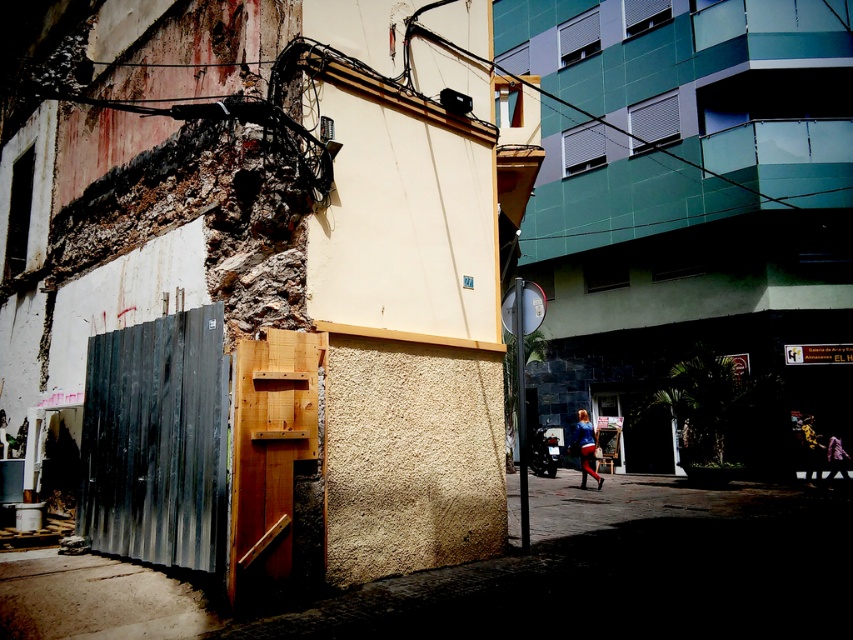
Measure the distance from metallic gold helmet at center to leather jacket at center.

13.75 inches

Is point (805, 464) closer to viewer compared to point (840, 451)?

No.

Is point (814, 452) positioned after point (834, 449)?

Yes, point (814, 452) is behind point (834, 449).

This screenshot has width=853, height=640. What are the coordinates of `metallic gold helmet at center` in the screenshot? It's located at (811, 451).

Is blue fabric skirt at lower center positioned before metallic gold helmet at center?

Yes, it is in front of metallic gold helmet at center.

Can you confirm if blue fabric skirt at lower center is positioned below metallic gold helmet at center?

Yes.

This screenshot has height=640, width=853. What are the coordinates of `blue fabric skirt at lower center` in the screenshot? It's located at (584, 445).

Find the location of a particular element. blue fabric skirt at lower center is located at coordinates click(x=584, y=445).

Is blue fabric skirt at lower center thinner than leather jacket at center?

Correct, blue fabric skirt at lower center's width is less than leather jacket at center's.

Is the position of blue fabric skirt at lower center more distant than that of leather jacket at center?

That is False.

This screenshot has width=853, height=640. What do you see at coordinates (584, 445) in the screenshot? I see `blue fabric skirt at lower center` at bounding box center [584, 445].

Where is `blue fabric skirt at lower center`? This screenshot has width=853, height=640. blue fabric skirt at lower center is located at coordinates [x=584, y=445].